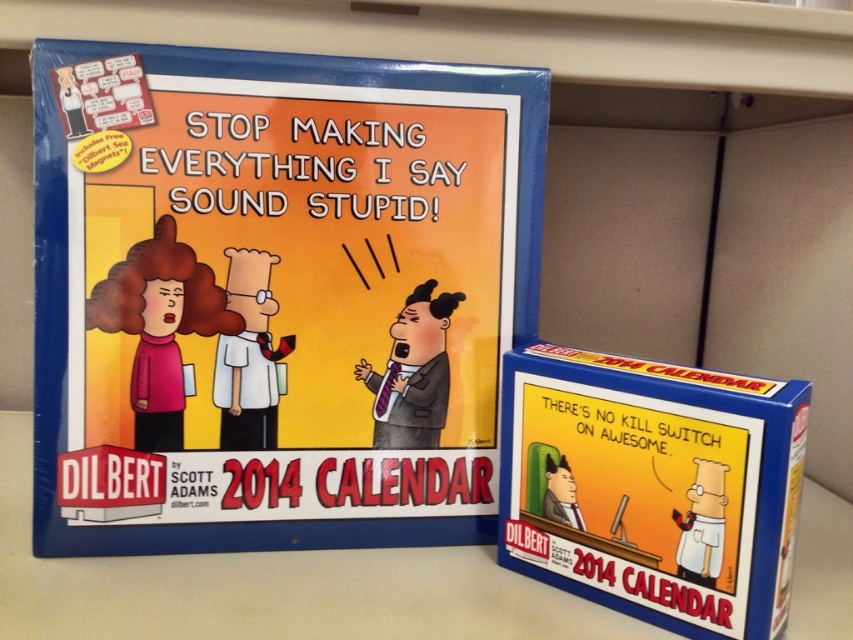
Can you confirm if matte blue calendar at upper left is positioned below blue cardboard box at center?

No.

Is matte blue calendar at upper left to the left of blue cardboard box at center from the viewer's perspective?

Yes, matte blue calendar at upper left is to the left of blue cardboard box at center.

The width and height of the screenshot is (853, 640). I want to click on matte blue calendar at upper left, so click(276, 296).